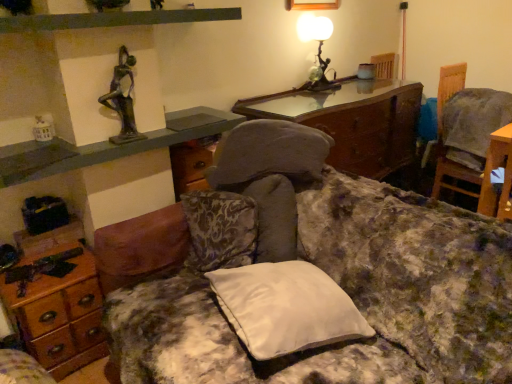
What do you see at coordinates (327, 273) in the screenshot?
I see `fluffy fabric couch at center` at bounding box center [327, 273].

What is the approximate height of wooden chair at right?

It is 82.47 centimeters.

The image size is (512, 384). I want to click on wooden desk at upper center, so click(352, 121).

What do you see at coordinates (352, 121) in the screenshot? I see `wooden desk at upper center` at bounding box center [352, 121].

Find the location of a particular element. The image size is (512, 384). matte black shelf at upper left is located at coordinates (106, 146).

Would you say bronze statue at upper left is a long distance from white satin pillow at center?

That's not correct — bronze statue at upper left is a little close to white satin pillow at center.

Is bronze statue at upper left shorter than white satin pillow at center?

No, bronze statue at upper left is not shorter than white satin pillow at center.

Is point (130, 93) farther from camera compared to point (256, 306)?

Yes, point (130, 93) is behind point (256, 306).

Is bronze statue at upper left to the left of white satin pillow at center from the viewer's perspective?

Yes, bronze statue at upper left is to the left of white satin pillow at center.

Can you confirm if bronze statue at upper left is thinner than matte black shelf at upper left?

Yes, bronze statue at upper left is thinner than matte black shelf at upper left.

Can you tell me how much bronze statue at upper left and matte black shelf at upper left differ in facing direction?

The angular difference between bronze statue at upper left and matte black shelf at upper left is 0.751 degrees.

From the image's perspective, which object appears higher, bronze statue at upper left or matte black shelf at upper left?

bronze statue at upper left.

Is bronze statue at upper left oriented towards matte black shelf at upper left?

No, bronze statue at upper left is not aimed at matte black shelf at upper left.

Based on the photo, is wooden desk at upper center spatially inside bronze statue at upper left, or outside of it?

wooden desk at upper center cannot be found inside bronze statue at upper left.

From the image's perspective, is wooden desk at upper center on top of bronze statue at upper left?

Incorrect, from the image's perspective, wooden desk at upper center is lower than bronze statue at upper left.

Between wooden desk at upper center and bronze statue at upper left, which one has more height?

With more height is wooden desk at upper center.

How distant is wooden desk at upper center from bronze statue at upper left?

They are 1.35 meters apart.

Is fluffy fabric couch at center in front of wooden desk at upper center?

Yes, fluffy fabric couch at center is closer to the viewer.

In terms of height, does fluffy fabric couch at center look taller or shorter compared to wooden desk at upper center?

fluffy fabric couch at center is taller than wooden desk at upper center.

Is fluffy fabric couch at center in contact with wooden desk at upper center?

No, fluffy fabric couch at center is not making contact with wooden desk at upper center.

Can we say fluffy fabric couch at center lies outside wooden desk at upper center?

Yes, fluffy fabric couch at center is outside of wooden desk at upper center.

Can you confirm if wooden chair at right is smaller than black matte shelf at upper center?

Incorrect, wooden chair at right is not smaller in size than black matte shelf at upper center.

Which object is thinner, wooden chair at right or black matte shelf at upper center?

With smaller width is black matte shelf at upper center.

From a real-world perspective, is wooden chair at right located higher than black matte shelf at upper center?

Incorrect, from a real-world perspective, wooden chair at right is lower than black matte shelf at upper center.

This screenshot has height=384, width=512. I want to click on chair that appears on the right of black matte shelf at upper center, so click(x=473, y=125).

Which object is positioned more to the left, white satin pillow at center or fluffy fabric couch at center?

Positioned to the left is white satin pillow at center.

From the image's perspective, which object appears higher, white satin pillow at center or fluffy fabric couch at center?

white satin pillow at center is shown above in the image.

Considering the sizes of white satin pillow at center and fluffy fabric couch at center in the image, is white satin pillow at center wider or thinner than fluffy fabric couch at center?

In the image, white satin pillow at center appears to be more narrow than fluffy fabric couch at center.

Which is behind, white satin pillow at center or fluffy fabric couch at center?

white satin pillow at center is further away from the camera.

Does point (306, 251) come closer to viewer compared to point (131, 118)?

Yes, point (306, 251) is in front of point (131, 118).

Looking at this image, is fluffy fabric couch at center shorter than bronze statue at upper left?

Incorrect, the height of fluffy fabric couch at center does not fall short of that of bronze statue at upper left.

You are a GUI agent. You are given a task and a screenshot of the screen. Output one action in this format:
    pyautogui.click(x=<x>, y=<y>)
    Task: Click on the studio couch that is under the bronze statue at upper left (from a real-world perspective)
    Image resolution: width=512 pixels, height=384 pixels.
    Given the screenshot: What is the action you would take?
    pyautogui.click(x=327, y=273)

You are a GUI agent. You are given a task and a screenshot of the screen. Output one action in this format:
    pyautogui.click(x=<x>, y=<y>)
    Task: Click on the person lying above the white satin pillow at center (from the image's perspective)
    This screenshot has width=512, height=384.
    Given the screenshot: What is the action you would take?
    pyautogui.click(x=122, y=99)

In the image, there is a bronze statue at upper left. At what (x,y) coordinates should I click in order to perform the action: click on cabinetry below it (from a real-world perspective). Please return your answer as a coordinate pair (x, y). Looking at the image, I should click on (106, 146).

When comparing their distances from wooden desk at upper center, does wooden chair at right or white satin pillow at center seem closer?

wooden chair at right.

Considering their positions, is matte glass table lamp at upper right positioned closer to matte black shelf at upper left than white satin pillow at center?

white satin pillow at center is positioned closer to the anchor matte black shelf at upper left.

Which object lies nearer to the anchor point matte glass table lamp at upper right, wooden desk at lower left or bronze statue at upper left?

Among the two, bronze statue at upper left is located nearer to matte glass table lamp at upper right.

Based on their spatial positions, is bronze statue at upper left or wooden desk at lower left further from fluffy fabric couch at center?

bronze statue at upper left is further to fluffy fabric couch at center.

Estimate the real-world distances between objects in this image. Which object is closer to fluffy fabric couch at center, wooden desk at lower left or bronze statue at upper left?

Among the two, wooden desk at lower left is located nearer to fluffy fabric couch at center.

Which object lies further to the anchor point matte glass table lamp at upper right, matte black shelf at upper left or wooden desk at lower left?

The object further to matte glass table lamp at upper right is wooden desk at lower left.

From the image, which object appears to be nearer to white satin pillow at center, bronze statue at upper left or matte glass table lamp at upper right?

The object closer to white satin pillow at center is bronze statue at upper left.

Based on their spatial positions, is fluffy fabric couch at center or white satin pillow at center further from bronze statue at upper left?

white satin pillow at center lies further to bronze statue at upper left than the other object.

You are a GUI agent. You are given a task and a screenshot of the screen. Output one action in this format:
    pyautogui.click(x=<x>, y=<y>)
    Task: Click on the desk between fluffy fabric couch at center and wooden desk at upper center in the front-back direction
    
    Given the screenshot: What is the action you would take?
    pyautogui.click(x=60, y=313)

Locate an element on the screen. This screenshot has width=512, height=384. studio couch between black matte shelf at upper center and wooden desk at lower left in the vertical direction is located at coordinates (327, 273).

The height and width of the screenshot is (384, 512). I want to click on table lamp between bronze statue at upper left and wooden chair at right in the horizontal direction, so click(x=318, y=49).

The height and width of the screenshot is (384, 512). What are the coordinates of `cabinetry between wooden desk at lower left and matte glass table lamp at upper right` in the screenshot? It's located at (106, 146).